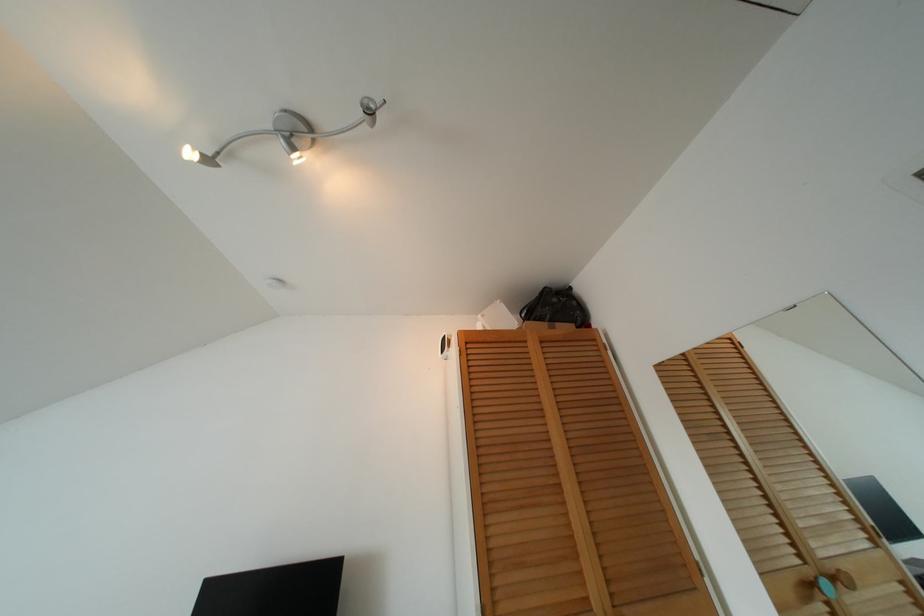
What do you see at coordinates (824, 586) in the screenshot? The image size is (924, 616). I see `a turquoise door knob` at bounding box center [824, 586].